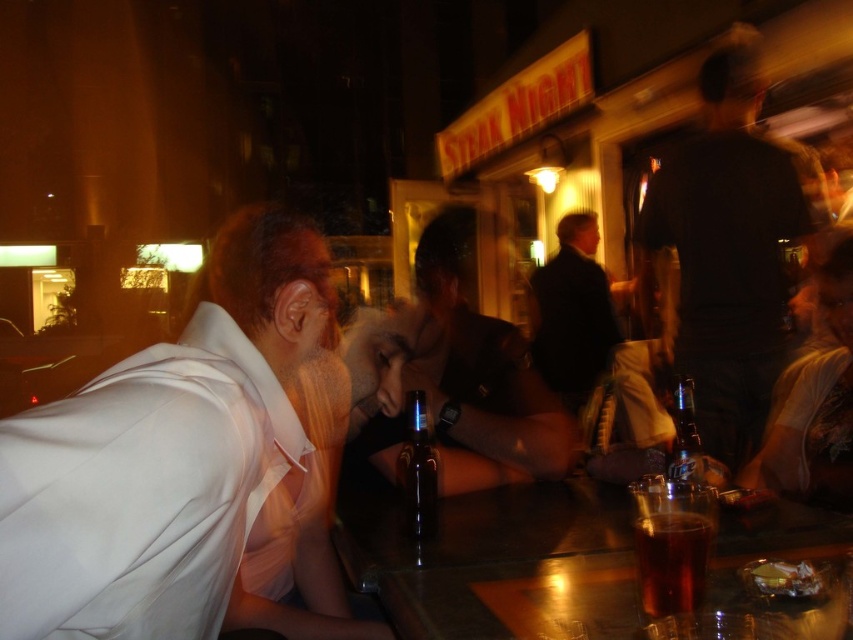
Question: Is white cotton shirt at left wider than black glass bottle at center?

Choices:
 (A) yes
 (B) no

Answer: (A)

Question: Does dark gray shirt at upper right appear on the left side of matte black shirt at center?

Choices:
 (A) no
 (B) yes

Answer: (A)

Question: Estimate the real-world distances between objects in this image. Which object is closer to the shiny brown wood table at center?

Choices:
 (A) dark brown leather jacket at center
 (B) translucent glass cup at bar

Answer: (B)

Question: Which is farther from the dark gray shirt at upper right?

Choices:
 (A) floral fabric dress at right
 (B) matte black shirt at center
 (C) shiny brown wood table at center

Answer: (C)

Question: Among these objects, which one is nearest to the camera?

Choices:
 (A) clear glass bottle at center
 (B) shiny brown wood table at center
 (C) matte black shirt at center
 (D) dark gray shirt at upper right

Answer: (B)

Question: From the image, what is the correct spatial relationship of shiny brown wood table at center in relation to floral fabric dress at right?

Choices:
 (A) below
 (B) above

Answer: (A)